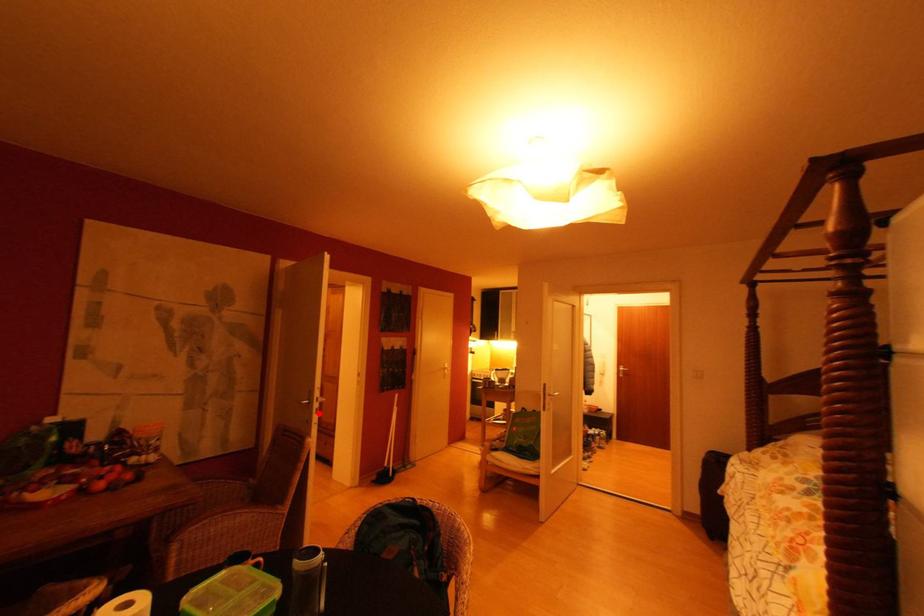
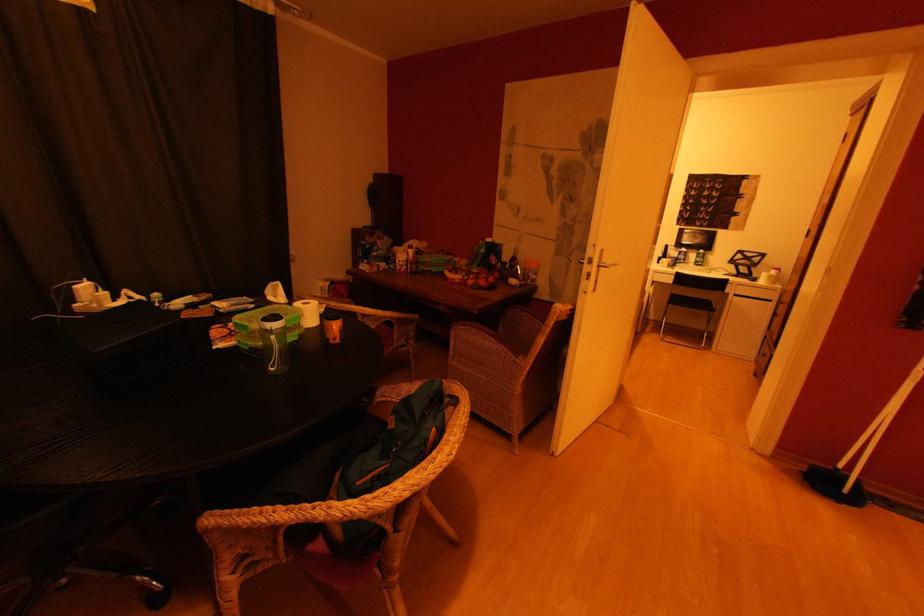
Question: I am providing you with two images of the same scene from different viewpoints. Image1 has a red point marked. In image2, the corresponding 3D location appears at what relative position? Reply with the corresponding letter.

Choices:
 (A) Closer
 (B) Farther

Answer: (A)